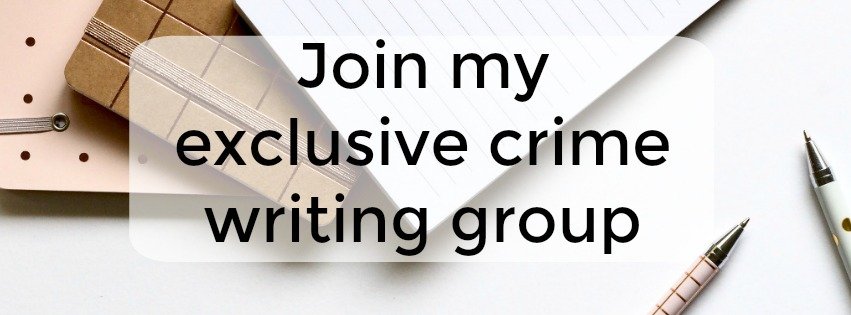
You are a GUI agent. You are given a task and a screenshot of the screen. Output one action in this format:
    pyautogui.click(x=<x>, y=<y>)
    Task: Click on the white surface
    The image size is (851, 315).
    Given the screenshot: What is the action you would take?
    pyautogui.click(x=46, y=269)